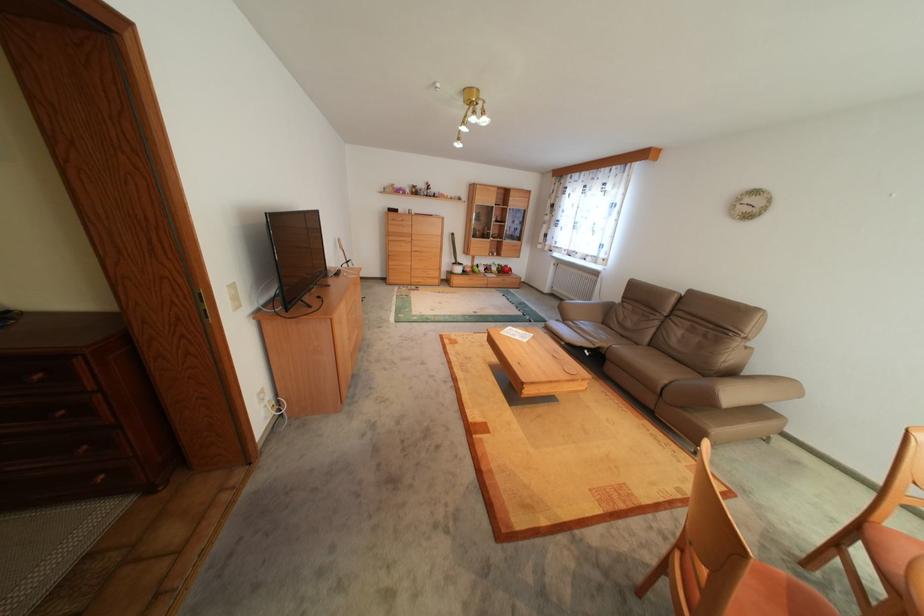
The height and width of the screenshot is (616, 924). Identify the location of chair sitting surface. (891, 552).